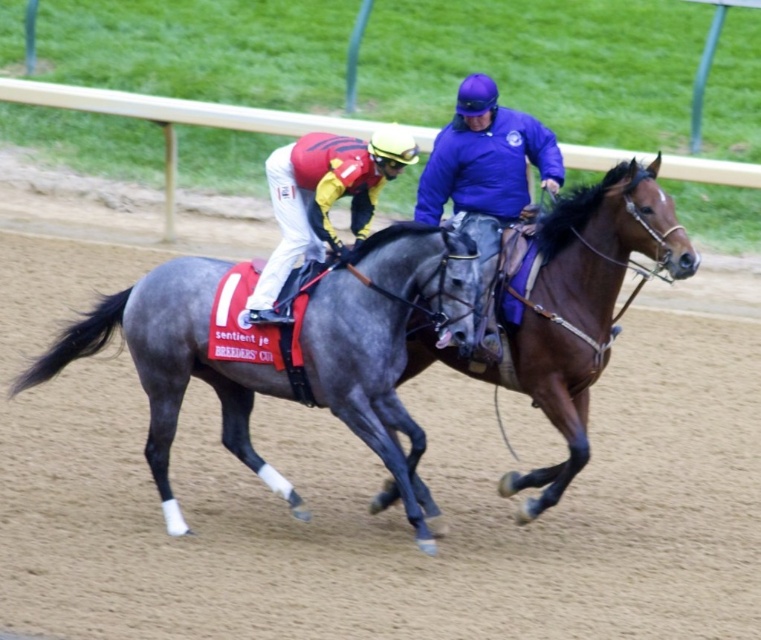
Who is more forward, (562, 237) or (403, 156)?

Point (403, 156)

Where is `brown glossy horse at center`? The height and width of the screenshot is (640, 761). brown glossy horse at center is located at coordinates (572, 310).

Who is more distant from viewer, (543,474) or (514,172)?

Positioned behind is point (514,172).

I want to click on brown glossy horse at center, so click(572, 310).

Which of these two, shiny gray horse at center or shiny black horse at center, stands taller?

With more height is shiny gray horse at center.

Is shiny gray horse at center wider than shiny black horse at center?

Yes.

What do you see at coordinates (387, 340) in the screenshot?
I see `shiny gray horse at center` at bounding box center [387, 340].

The image size is (761, 640). I want to click on shiny gray horse at center, so (x=387, y=340).

Looking at this image, does shiny gray horse at center appear on the left side of purple smooth jacket at center?

Correct, you'll find shiny gray horse at center to the left of purple smooth jacket at center.

Is point (174, 316) in front of point (454, 166)?

That is True.

Locate an element on the screen. shiny gray horse at center is located at coordinates (387, 340).

Identify the location of shiny gray horse at center. (387, 340).